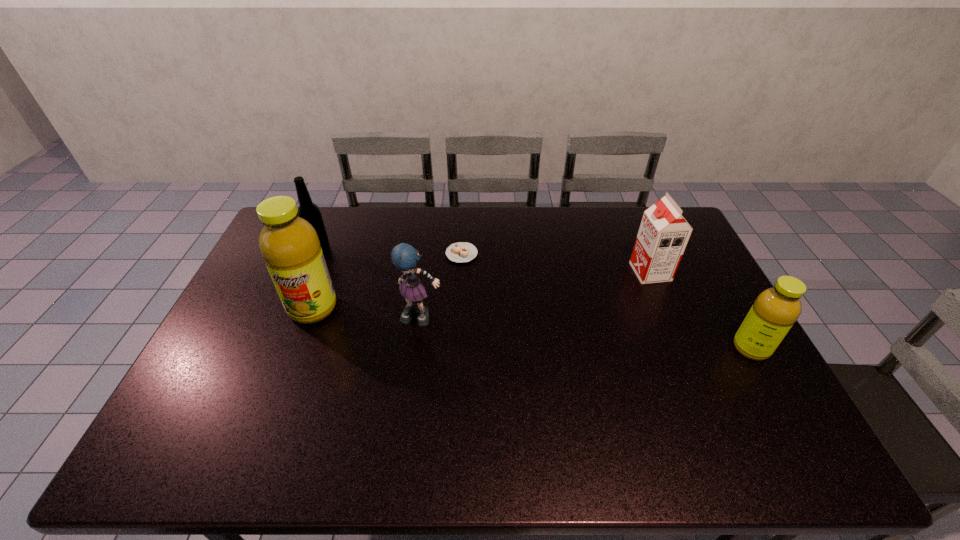
Locate an element on the screen. Image resolution: width=960 pixels, height=540 pixels. vacant space at the near edge is located at coordinates (636, 413).

Identify the location of vacant region at the right edge. (720, 358).

Find the location of `vacant space at the near left corner`. vacant space at the near left corner is located at coordinates (227, 408).

You are a GUI agent. You are given a task and a screenshot of the screen. Output one action in this format:
    pyautogui.click(x=<x>, y=<y>)
    Task: Click on the free space at the far right corner
    This screenshot has height=540, width=960.
    Given the screenshot: What is the action you would take?
    pyautogui.click(x=633, y=213)

What are the coordinates of `vacant point located between the rag doll and the beer bottle` in the screenshot? It's located at (371, 282).

At what (x,y) coordinates should I click in order to perform the action: click on vacant space in between the right fruit juice and the beer bottle. Please return your answer as a coordinate pair (x, y). Looking at the image, I should click on (536, 298).

Locate an element on the screen. empty space that is in between the rag doll and the rightmost object is located at coordinates (587, 333).

This screenshot has height=540, width=960. I want to click on free space between the right fruit juice and the rag doll, so click(x=587, y=333).

Identify the location of free point between the rag doll and the tallest object. (368, 313).

Where is `unoccupied area between the taller fruit juice and the second object from right to left`? This screenshot has width=960, height=540. unoccupied area between the taller fruit juice and the second object from right to left is located at coordinates (482, 290).